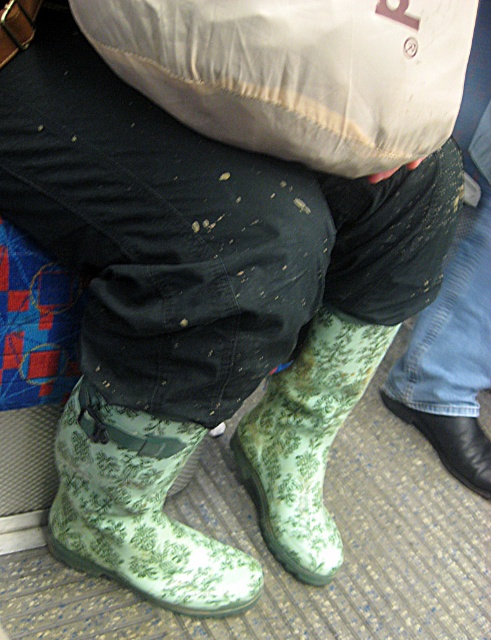
You are a delivery person who needs to place a small package between the white fabric sack at upper center and the green floral rubber boot at center. Can you fit it there?

The white fabric sack at upper center is 18.13 inches from the green floral rubber boot at center, so yes, the small package can fit between them as the distance is sufficient.

You are a tailor trying to create a pair of custom socks for both the green floral rubber boot at lower center and the green floral rubber boot at center. Which boot requires wider socks?

The green floral rubber boot at lower center requires wider socks because its width is larger than the green floral rubber boot at center.